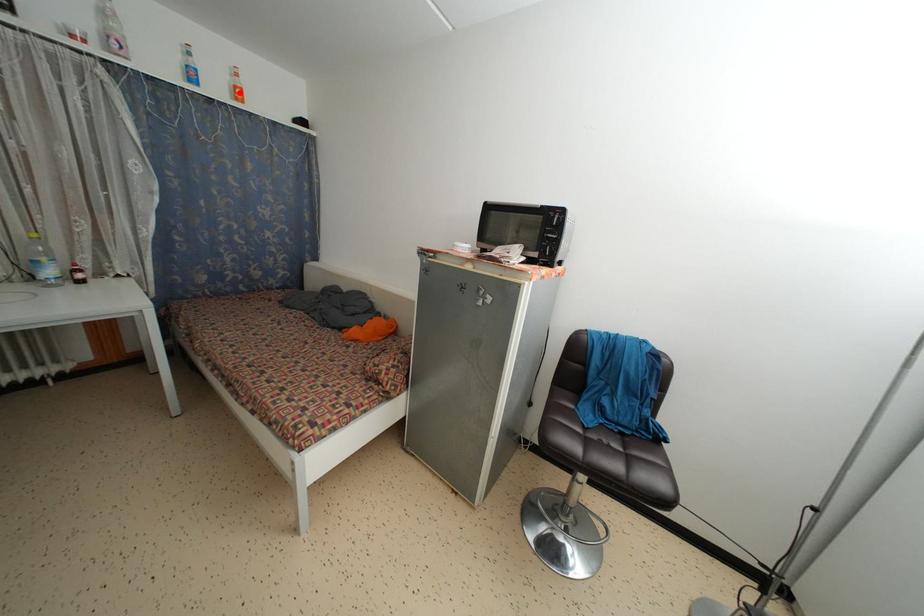
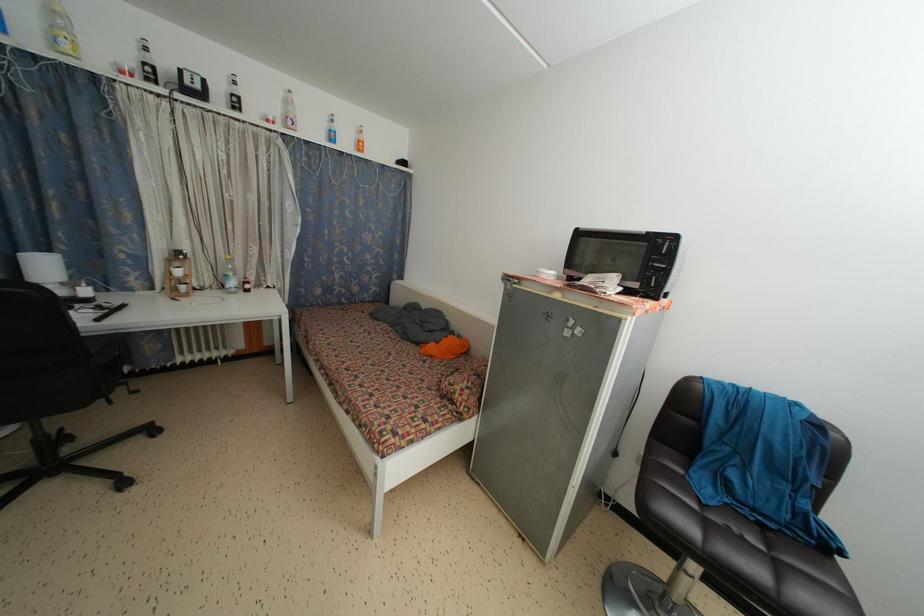
In the second image, find the point that corresponds to the highlighted location in the first image.

(362, 147)